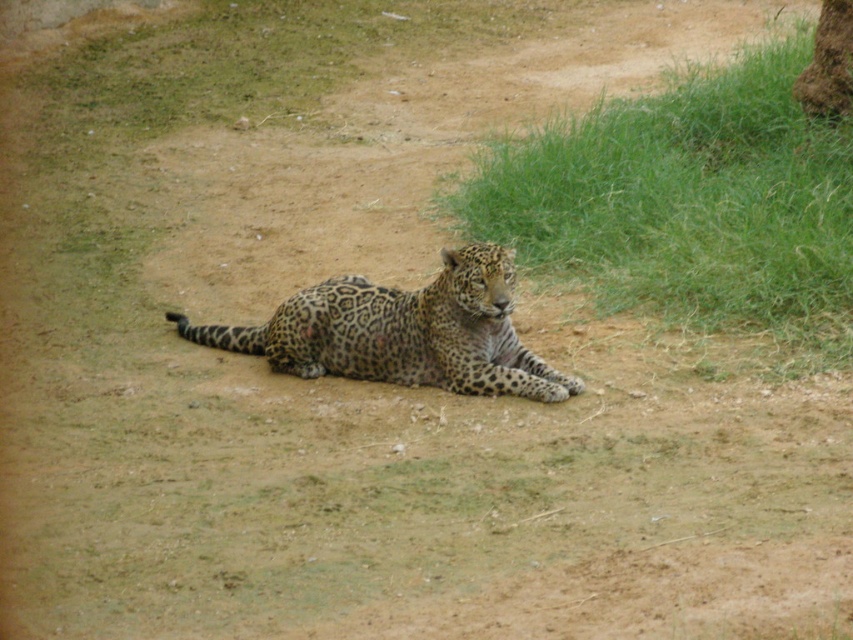
What do you see at coordinates (688, 202) in the screenshot? Image resolution: width=853 pixels, height=640 pixels. I see `green grass at center` at bounding box center [688, 202].

Does green grass at center have a lesser height compared to spotted fur leopard at center?

Incorrect, green grass at center's height does not fall short of spotted fur leopard at center's.

Which is behind, point (775, 129) or point (349, 371)?

Point (775, 129)

Locate an element on the screen. This screenshot has height=640, width=853. green grass at center is located at coordinates (688, 202).